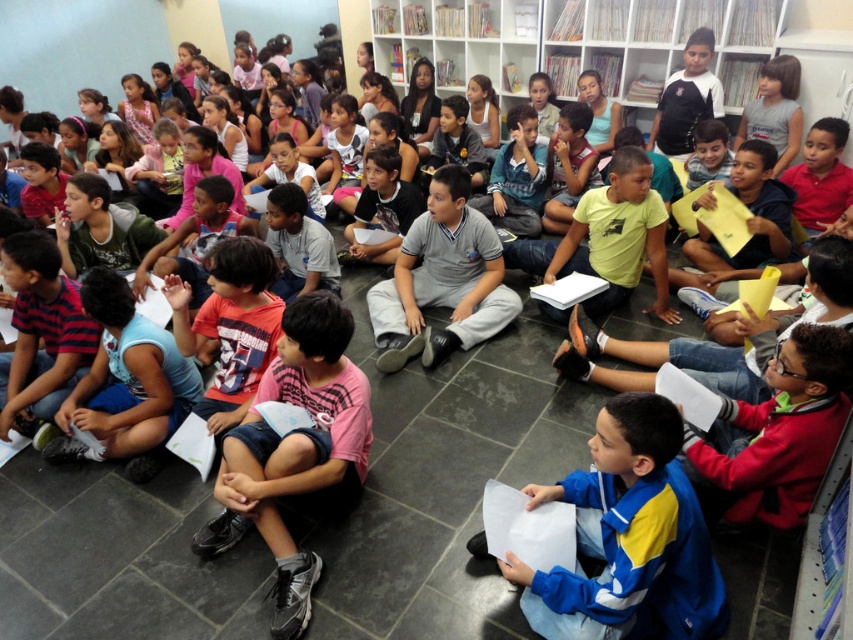
Question: Is the position of white glossy bookshelf at upper center more distant than that of gray cotton shirt at center?

Choices:
 (A) yes
 (B) no

Answer: (A)

Question: Is white glossy bookshelf at upper center to the left of gray cotton shirt at center from the viewer's perspective?

Choices:
 (A) yes
 (B) no

Answer: (B)

Question: Which point is farther to the camera?

Choices:
 (A) gray cotton shirt at center
 (B) white glossy bookshelf at upper center

Answer: (B)

Question: Can you confirm if white glossy bookshelf at upper center is positioned to the left of gray cotton shirt at center?

Choices:
 (A) yes
 (B) no

Answer: (B)